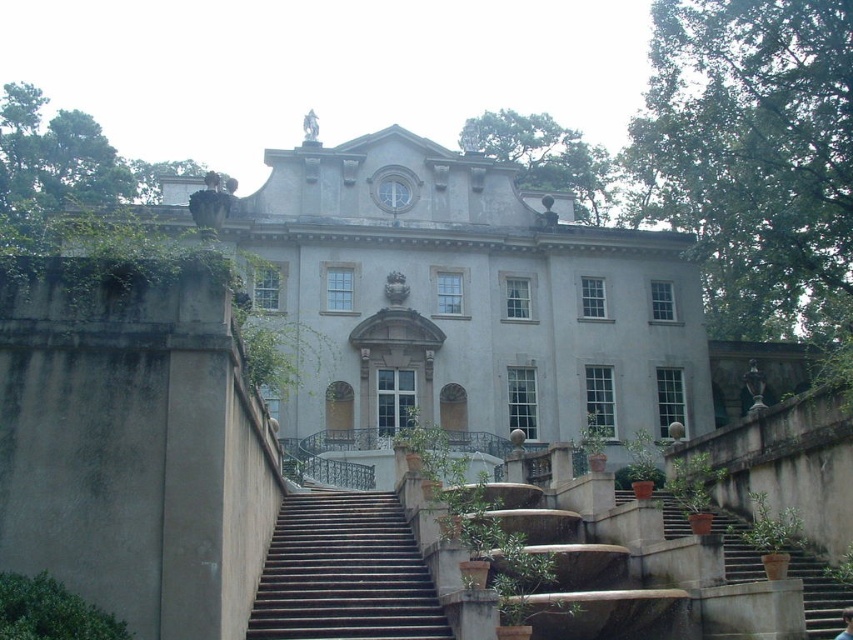
Measure the distance between point (410, 230) and camera.

83.53 meters

Who is more distant from viewer, (653,332) or (732,540)?

The point (653,332) is more distant.

You are a GUI agent. You are given a task and a screenshot of the screen. Output one action in this format:
    pyautogui.click(x=<x>, y=<y>)
    Task: Click on the white stone mansion at center
    The height and width of the screenshot is (640, 853).
    Given the screenshot: What is the action you would take?
    pyautogui.click(x=463, y=300)

You are a GUI agent. You are given a task and a screenshot of the screen. Output one action in this format:
    pyautogui.click(x=<x>, y=<y>)
    Task: Click on the white stone mansion at center
    This screenshot has width=853, height=640.
    Given the screenshot: What is the action you would take?
    pyautogui.click(x=463, y=300)

Between point (561, 196) and point (288, 513), which one is positioned in front?

Positioned in front is point (288, 513).

Is white stone mansion at center shorter than dark brown stone stairs at center?

In fact, white stone mansion at center may be taller than dark brown stone stairs at center.

You are a GUI agent. You are given a task and a screenshot of the screen. Output one action in this format:
    pyautogui.click(x=<x>, y=<y>)
    Task: Click on the white stone mansion at center
    The image size is (853, 640).
    Given the screenshot: What is the action you would take?
    pyautogui.click(x=463, y=300)

Between point (293, 563) and point (744, 520), which one is positioned in front?

Point (293, 563) is in front.

In the scene shown: Is dark brown stone stairs at center smaller than brown concrete stairs at lower right?

Correct, dark brown stone stairs at center occupies less space than brown concrete stairs at lower right.

Who is more distant from viewer, (347,566) or (833,609)?

The point (833,609) is more distant.

Identify the location of dark brown stone stairs at center. The image size is (853, 640). (344, 572).